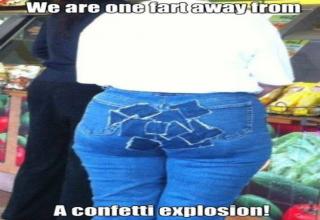
The width and height of the screenshot is (320, 220). I want to click on poster, so click(3, 104), click(24, 108), click(291, 147).